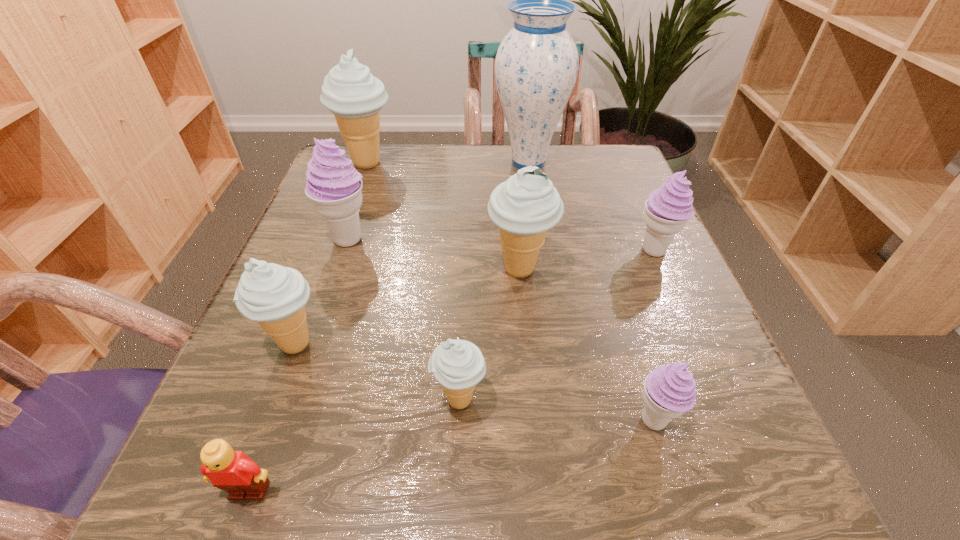
The image size is (960, 540). What are the coordinates of `free space between the second tallest object and the vase` in the screenshot? It's located at (448, 163).

Locate an element on the screen. This screenshot has width=960, height=540. vacant area that lies between the fourth icecream from left to right and the leftmost purple icecream is located at coordinates (404, 319).

Where is `free space between the brown Lego and the nearest beige icecream`? The image size is (960, 540). free space between the brown Lego and the nearest beige icecream is located at coordinates (354, 446).

The height and width of the screenshot is (540, 960). In order to click on free point between the rightmost beige icecream and the third farthest beige icecream in this screenshot , I will do `click(408, 307)`.

Find the location of a particular element. Image resolution: width=960 pixels, height=540 pixels. vacant space that's between the biggest purple icecream and the nearest beige icecream is located at coordinates (404, 319).

Find the location of a particular element. empty location between the Lego and the blue vase is located at coordinates (389, 327).

This screenshot has width=960, height=540. What are the coordinates of `free space between the farthest icecream and the third biggest beige icecream` in the screenshot? It's located at (331, 253).

I want to click on vacant space that is in between the tallest icecream and the nearest object, so click(x=308, y=327).

Where is `the third closest object to the second nearest beige icecream`? The image size is (960, 540). the third closest object to the second nearest beige icecream is located at coordinates (458, 365).

Identify which object is the closest to the second farthest beige icecream. Please provide its 2D coordinates. Your answer should be formatted as a tuple, i.e. [(x, y)], where the tuple contains the x and y coordinates of a point satisfying the conditions above.

[(668, 208)]